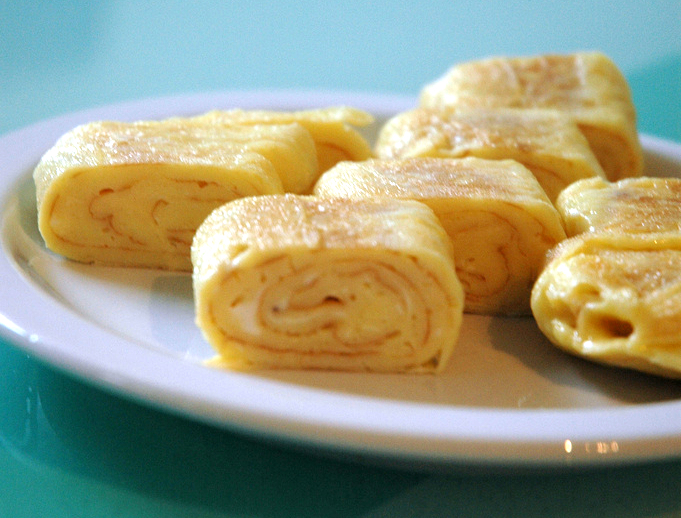
Find the location of a particular element. The width and height of the screenshot is (681, 518). edge of plate is located at coordinates (280, 92).